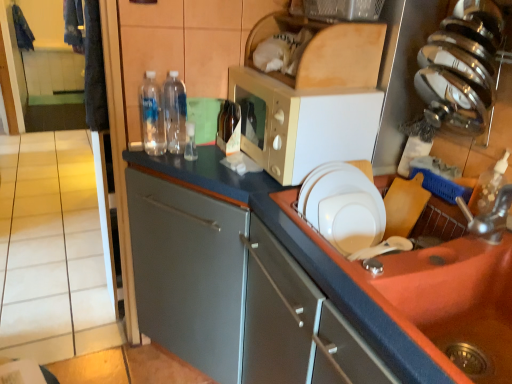
Question: From the image's perspective, would you say beige tile at left is shown under orange matte sink at lower right?

Choices:
 (A) yes
 (B) no

Answer: (B)

Question: Does beige tile at left have a greater height compared to orange matte sink at lower right?

Choices:
 (A) yes
 (B) no

Answer: (A)

Question: Is beige tile at left thinner than orange matte sink at lower right?

Choices:
 (A) yes
 (B) no

Answer: (A)

Question: Is beige tile at left to the left of orange matte sink at lower right from the viewer's perspective?

Choices:
 (A) yes
 (B) no

Answer: (A)

Question: Is beige tile at left positioned with its back to orange matte sink at lower right?

Choices:
 (A) no
 (B) yes

Answer: (A)

Question: From a real-world perspective, relative to beige tile at left, is matte gray cabinet at center vertically above or below?

Choices:
 (A) below
 (B) above

Answer: (A)

Question: Is matte gray cabinet at center taller or shorter than beige tile at left?

Choices:
 (A) tall
 (B) short

Answer: (B)

Question: Considering their positions, is matte gray cabinet at center located in front of or behind beige tile at left?

Choices:
 (A) front
 (B) behind

Answer: (B)

Question: Is matte gray cabinet at center inside the boundaries of beige tile at left, or outside?

Choices:
 (A) inside
 (B) outside

Answer: (B)

Question: Is satin silver knife block at upper right taller or shorter than orange matte sink at lower right?

Choices:
 (A) short
 (B) tall

Answer: (B)

Question: From the image's perspective, is satin silver knife block at upper right located above or below orange matte sink at lower right?

Choices:
 (A) above
 (B) below

Answer: (A)

Question: From a real-world perspective, relative to orange matte sink at lower right, is satin silver knife block at upper right vertically above or below?

Choices:
 (A) above
 (B) below

Answer: (A)

Question: Is satin silver knife block at upper right situated inside orange matte sink at lower right or outside?

Choices:
 (A) inside
 (B) outside

Answer: (B)

Question: From the image's perspective, is white glossy plate at upper right located above or below transparent plastic bottle at center, the 2th bottle when ordered from left to right?

Choices:
 (A) above
 (B) below

Answer: (B)

Question: Is white glossy plate at upper right to the left or to the right of transparent plastic bottle at center, the 2th bottle when ordered from left to right, in the image?

Choices:
 (A) right
 (B) left

Answer: (A)